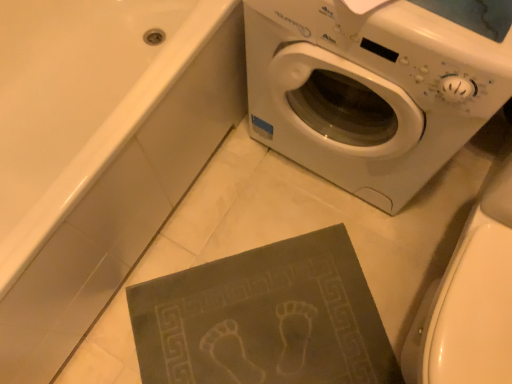
Image resolution: width=512 pixels, height=384 pixels. Find the location of `white glossy toilet bowl at lower right`. white glossy toilet bowl at lower right is located at coordinates (470, 299).

Locate an element on the screen. The height and width of the screenshot is (384, 512). white plastic washing machine at upper right is located at coordinates (375, 86).

Where is `matte gray bath mat at lower center`? This screenshot has height=384, width=512. matte gray bath mat at lower center is located at coordinates (99, 152).

Is white glossy toilet bowl at lower right in front of white plastic washing machine at upper right?

That is True.

Can you confirm if white glossy toilet bowl at lower right is positioned to the right of white plastic washing machine at upper right?

Yes.

Does point (435, 359) lie in front of point (418, 175)?

Yes, it is.

Which object is thinner, white glossy toilet bowl at lower right or white plastic washing machine at upper right?

With smaller width is white plastic washing machine at upper right.

Is matte gray bath mat at lower center wider than white glossy toilet bowl at lower right?

Yes.

Measure the distance from matte gray bath mat at lower center to white glossy toilet bowl at lower right.

matte gray bath mat at lower center and white glossy toilet bowl at lower right are 27.64 inches apart.

Looking at this image, are matte gray bath mat at lower center and white glossy toilet bowl at lower right far apart?

No.

From a real-world perspective, is matte gray bath mat at lower center positioned under white glossy toilet bowl at lower right based on gravity?

Yes, from a real-world perspective, matte gray bath mat at lower center is under white glossy toilet bowl at lower right.

Does point (232, 122) lie in front of point (338, 25)?

No, (232, 122) is further to viewer.

Can white plastic washing machine at upper right be found inside matte gray bath mat at lower center?

No.

At what (x,y) coordinates should I click in order to perform the action: click on bath that is in front of the white plastic washing machine at upper right. Please return your answer as a coordinate pair (x, y). The width and height of the screenshot is (512, 384). Looking at the image, I should click on (99, 152).

Does matte gray bath mat at lower center touch white plastic washing machine at upper right?

matte gray bath mat at lower center and white plastic washing machine at upper right are clearly separated.

Is matte gray bath mat at lower center positioned with its back to dark gray textured mat at lower center?

No, matte gray bath mat at lower center is not facing the opposite direction of dark gray textured mat at lower center.

Considering the relative positions of matte gray bath mat at lower center and dark gray textured mat at lower center in the image provided, is matte gray bath mat at lower center to the left of dark gray textured mat at lower center from the viewer's perspective?

Yes.

Is matte gray bath mat at lower center smaller than dark gray textured mat at lower center?

Actually, matte gray bath mat at lower center might be larger than dark gray textured mat at lower center.

How many degrees apart are the facing directions of matte gray bath mat at lower center and dark gray textured mat at lower center?

48.7 degrees separate the facing orientations of matte gray bath mat at lower center and dark gray textured mat at lower center.

Which object is wider, white glossy toilet bowl at lower right or matte gray bath mat at lower center?

Wider between the two is matte gray bath mat at lower center.

Is white glossy toilet bowl at lower right bigger than matte gray bath mat at lower center?

Incorrect, white glossy toilet bowl at lower right is not larger than matte gray bath mat at lower center.

The image size is (512, 384). Identify the location of bath behind the white glossy toilet bowl at lower right. (99, 152).

Can you tell me how much white glossy toilet bowl at lower right and matte gray bath mat at lower center differ in facing direction?

The angular difference between white glossy toilet bowl at lower right and matte gray bath mat at lower center is 90 degrees.

This screenshot has width=512, height=384. Identify the location of toilet bowl in front of the white plastic washing machine at upper right. (470, 299).

Consider the image. Is white plastic washing machine at upper right oriented away from white glossy toilet bowl at lower right?

No, white plastic washing machine at upper right is not facing away from white glossy toilet bowl at lower right.

Is white plastic washing machine at upper right far away from white glossy toilet bowl at lower right?

No, white plastic washing machine at upper right is in close proximity to white glossy toilet bowl at lower right.

In the image, is white plastic washing machine at upper right on the left side or the right side of white glossy toilet bowl at lower right?

white plastic washing machine at upper right is to the left of white glossy toilet bowl at lower right.

Can you confirm if white glossy toilet bowl at lower right is positioned to the right of dark gray textured mat at lower center?

Indeed, white glossy toilet bowl at lower right is positioned on the right side of dark gray textured mat at lower center.

This screenshot has height=384, width=512. In the image, there is a white glossy toilet bowl at lower right. Identify the location of paperback book below it (from a real-world perspective). (265, 318).

Is white glossy toilet bowl at lower right smaller than dark gray textured mat at lower center?

No, white glossy toilet bowl at lower right is not smaller than dark gray textured mat at lower center.

Which is in front, point (485, 237) or point (309, 254)?

The point (485, 237) is closer to the camera.

Find the location of a particular element. This screenshot has height=384, width=512. toilet bowl that is above the white plastic washing machine at upper right (from a real-world perspective) is located at coordinates (470, 299).

This screenshot has height=384, width=512. I want to click on bath that is under the white glossy toilet bowl at lower right (from a real-world perspective), so click(99, 152).

Estimate the real-world distances between objects in this image. Which object is further from white plastic washing machine at upper right, matte gray bath mat at lower center or dark gray textured mat at lower center?

dark gray textured mat at lower center.

Looking at the image, which one is located closer to white glossy toilet bowl at lower right, dark gray textured mat at lower center or matte gray bath mat at lower center?

Based on the image, dark gray textured mat at lower center appears to be nearer to white glossy toilet bowl at lower right.

From the image, which object appears to be farther from white glossy toilet bowl at lower right, white plastic washing machine at upper right or matte gray bath mat at lower center?

matte gray bath mat at lower center is positioned further to the anchor white glossy toilet bowl at lower right.

When comparing their distances from dark gray textured mat at lower center, does matte gray bath mat at lower center or white glossy toilet bowl at lower right seem further?

matte gray bath mat at lower center lies further to dark gray textured mat at lower center than the other object.

When comparing their distances from matte gray bath mat at lower center, does white plastic washing machine at upper right or dark gray textured mat at lower center seem further?

dark gray textured mat at lower center is further to matte gray bath mat at lower center.

Estimate the real-world distances between objects in this image. Which object is closer to matte gray bath mat at lower center, white plastic washing machine at upper right or white glossy toilet bowl at lower right?

Among the two, white plastic washing machine at upper right is located nearer to matte gray bath mat at lower center.

Estimate the real-world distances between objects in this image. Which object is closer to dark gray textured mat at lower center, white glossy toilet bowl at lower right or matte gray bath mat at lower center?

Among the two, white glossy toilet bowl at lower right is located nearer to dark gray textured mat at lower center.

Considering their positions, is dark gray textured mat at lower center positioned closer to white plastic washing machine at upper right than white glossy toilet bowl at lower right?

white glossy toilet bowl at lower right is closer to white plastic washing machine at upper right.

This screenshot has width=512, height=384. In order to click on bath between white plastic washing machine at upper right and dark gray textured mat at lower center in the up-down direction in this screenshot , I will do `click(99, 152)`.

You are a GUI agent. You are given a task and a screenshot of the screen. Output one action in this format:
    pyautogui.click(x=<x>, y=<y>)
    Task: Click on the paperback book between matte gray bath mat at lower center and white glossy toilet bowl at lower right
    
    Given the screenshot: What is the action you would take?
    pyautogui.click(x=265, y=318)

I want to click on washing machine situated between matte gray bath mat at lower center and white glossy toilet bowl at lower right from left to right, so click(375, 86).

Where is `toilet bowl between white plastic washing machine at upper right and dark gray textured mat at lower center vertically`? This screenshot has height=384, width=512. toilet bowl between white plastic washing machine at upper right and dark gray textured mat at lower center vertically is located at coordinates (470, 299).